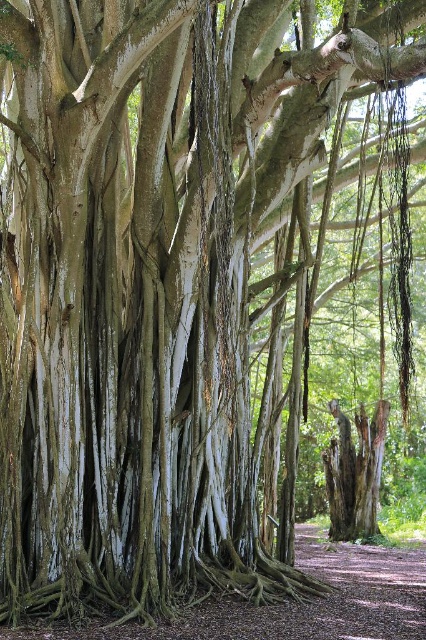
Is brown dirt path at lower center behind smooth gray bark at center?

No, it is not.

Is brown dirt path at lower center to the left of smooth gray bark at center from the viewer's perspective?

Yes, brown dirt path at lower center is to the left of smooth gray bark at center.

Does point (405, 605) come closer to viewer compared to point (368, 512)?

Yes, it is in front of point (368, 512).

Where is `brown dirt path at lower center`? The height and width of the screenshot is (640, 426). brown dirt path at lower center is located at coordinates (296, 602).